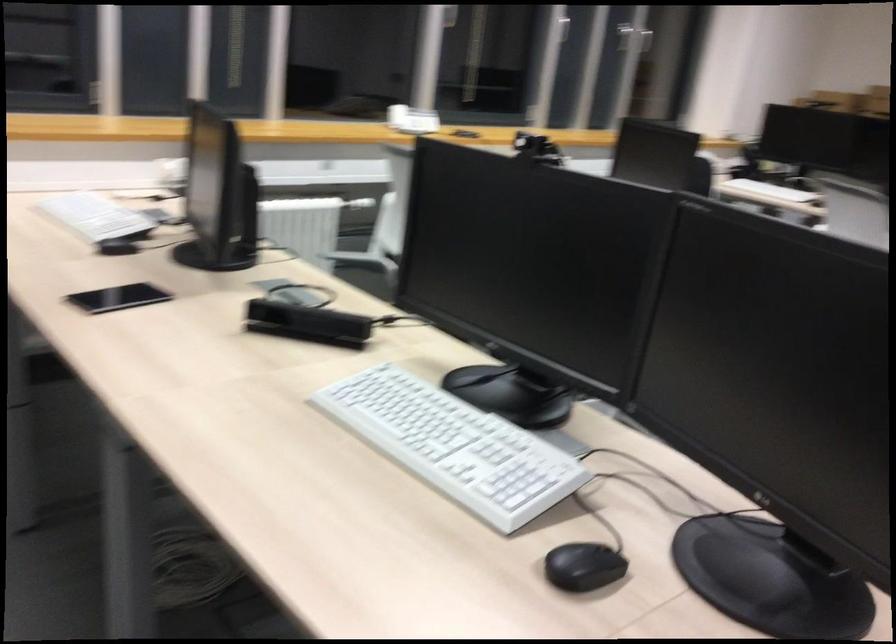
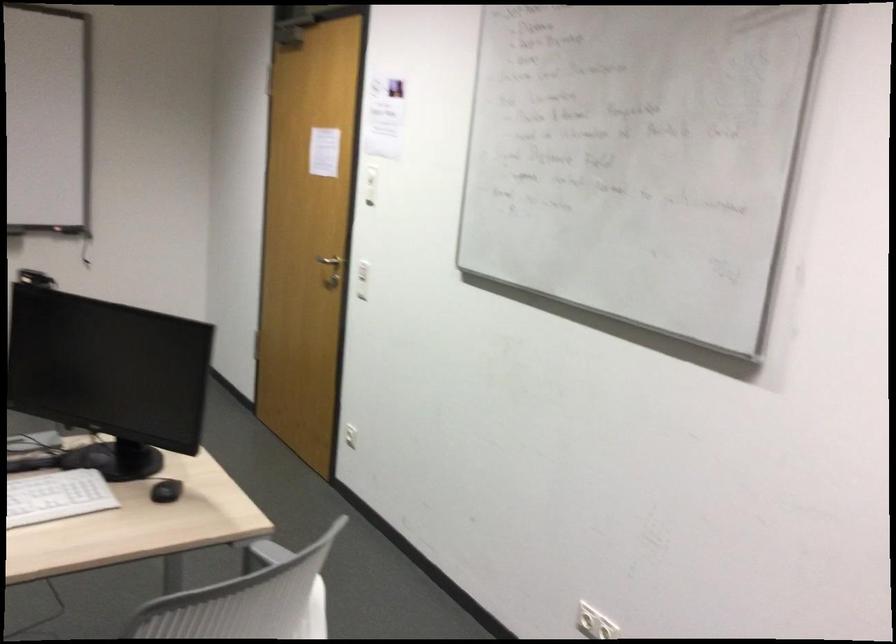
Based on the continuous images, in which direction is the camera rotating?

The camera's rotation is toward right-down.